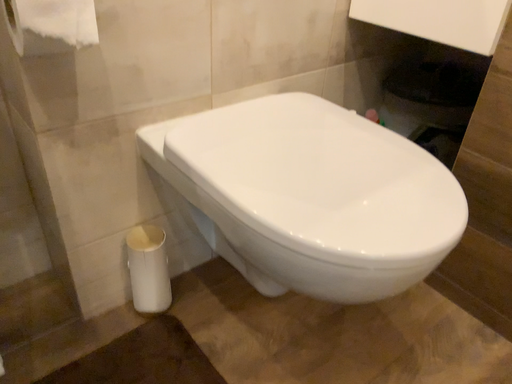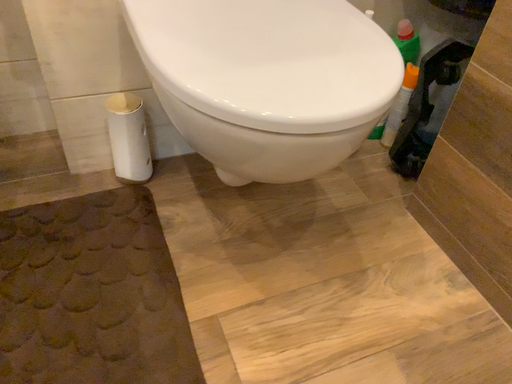
Question: Which way did the camera rotate in the video?

Choices:
 (A) rotated downward
 (B) rotated upward

Answer: (A)